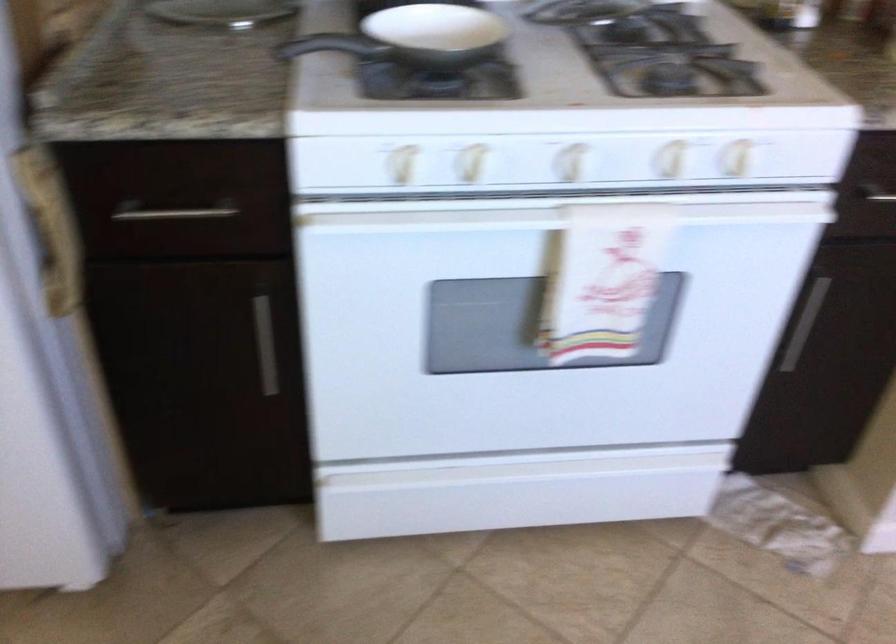
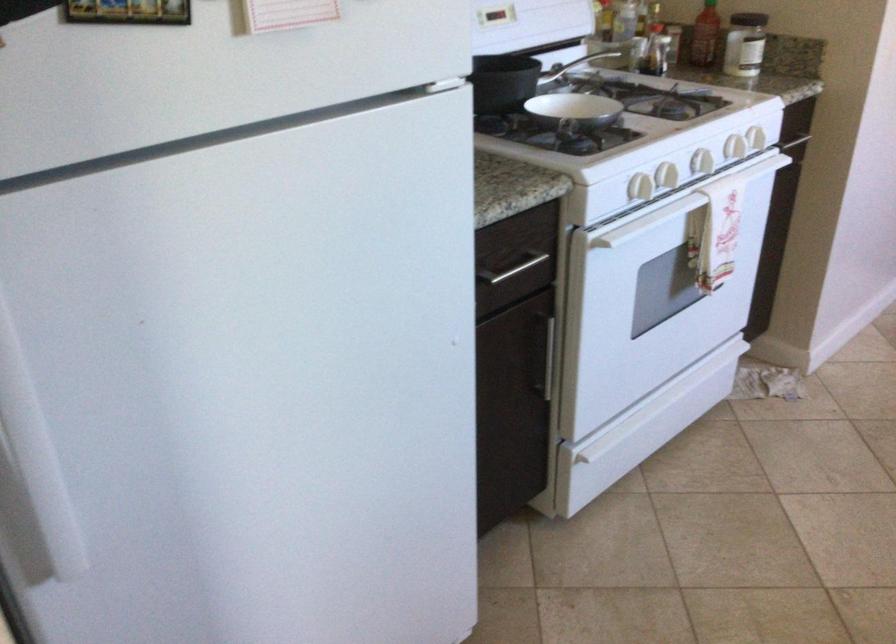
Locate, in the second image, the point that corresponds to [350,202] in the first image.

(640, 187)